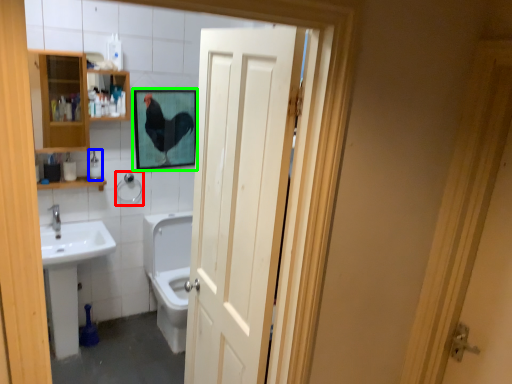
Question: Which object is positioned farthest from towel bar (highlighted by a red box)? Select from toiletry (highlighted by a blue box) and picture frame (highlighted by a green box).

Choices:
 (A) toiletry
 (B) picture frame

Answer: (B)